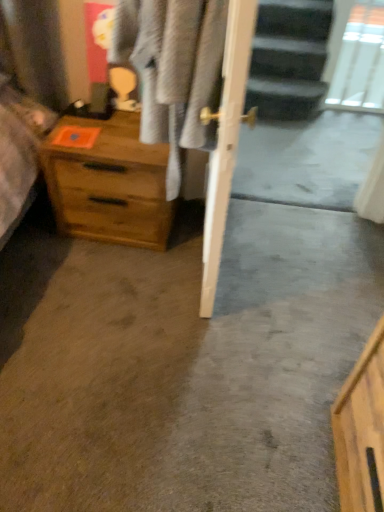
Question: Is light gray fabric at center far from wooden chest of drawers at left?

Choices:
 (A) yes
 (B) no

Answer: (B)

Question: Is light gray fabric at center surrounding wooden chest of drawers at left?

Choices:
 (A) no
 (B) yes

Answer: (A)

Question: Is light gray fabric at center bigger than wooden chest of drawers at left?

Choices:
 (A) no
 (B) yes

Answer: (B)

Question: Can we say light gray fabric at center lies outside wooden chest of drawers at left?

Choices:
 (A) yes
 (B) no

Answer: (A)

Question: Does light gray fabric at center have a greater width compared to wooden chest of drawers at left?

Choices:
 (A) yes
 (B) no

Answer: (B)

Question: Is light gray fabric at center smaller than wooden chest of drawers at left?

Choices:
 (A) no
 (B) yes

Answer: (A)

Question: Does wooden chest of drawers at left have a greater width compared to light gray fabric at center?

Choices:
 (A) no
 (B) yes

Answer: (B)

Question: Can you confirm if wooden chest of drawers at left is bigger than light gray fabric at center?

Choices:
 (A) no
 (B) yes

Answer: (A)

Question: Does wooden chest of drawers at left turn towards light gray fabric at center?

Choices:
 (A) yes
 (B) no

Answer: (B)

Question: Can you confirm if wooden chest of drawers at left is shorter than light gray fabric at center?

Choices:
 (A) no
 (B) yes

Answer: (B)

Question: Is wooden chest of drawers at left with light gray fabric at center?

Choices:
 (A) yes
 (B) no

Answer: (B)

Question: Is wooden chest of drawers at left in front of light gray fabric at center?

Choices:
 (A) yes
 (B) no

Answer: (B)

Question: Does wooden chest of drawers at left have a larger size compared to transparent glass door at upper right?

Choices:
 (A) no
 (B) yes

Answer: (B)